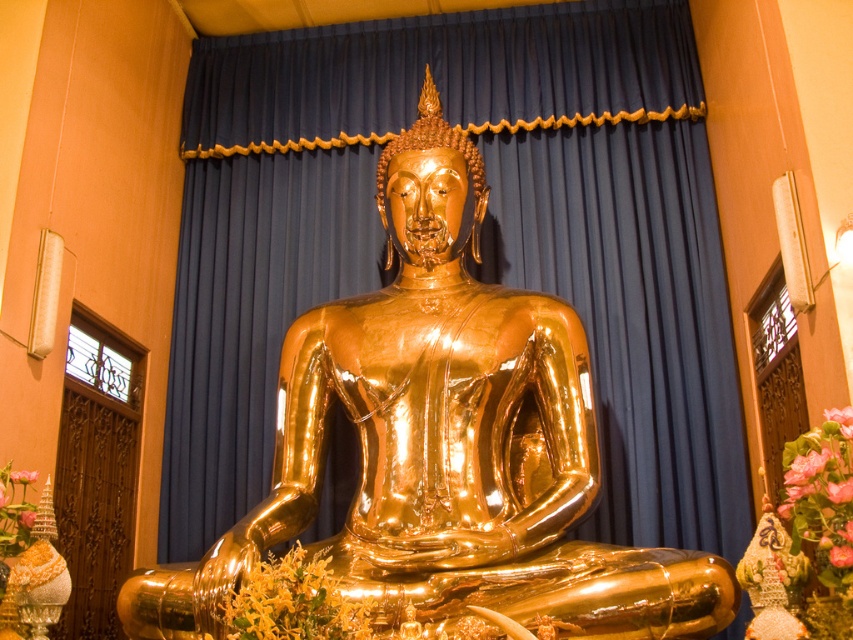
Who is positioned more to the right, pink silk flower at lower right or pink floral bouquet at center?

pink silk flower at lower right is more to the right.

Does pink silk flower at lower right have a lesser height compared to pink floral bouquet at center?

No, pink silk flower at lower right is not shorter than pink floral bouquet at center.

Between point (813, 456) and point (24, 528), which one is positioned in front?

Point (813, 456) is more forward.

In order to click on pink silk flower at lower right in this screenshot , I will do `click(821, 488)`.

Does pink silk flower at center have a greater width compared to pink floral bouquet at center?

Yes, pink silk flower at center is wider than pink floral bouquet at center.

How distant is pink silk flower at center from pink floral bouquet at center?

pink silk flower at center is 8.89 inches from pink floral bouquet at center.

Who is more distant from viewer, (10, 476) or (21, 522)?

The point (10, 476) is behind.

This screenshot has height=640, width=853. In order to click on pink silk flower at center in this screenshot , I will do `click(22, 476)`.

Is gold shiny statue at center shorter than pink floral bouquet at center?

No.

Is gold shiny statue at center smaller than pink floral bouquet at center?

No, gold shiny statue at center is not smaller than pink floral bouquet at center.

Between point (579, 419) and point (28, 513), which one is positioned behind?

The point (579, 419) is more distant.

Locate an element on the screen. This screenshot has width=853, height=640. gold shiny statue at center is located at coordinates (445, 444).